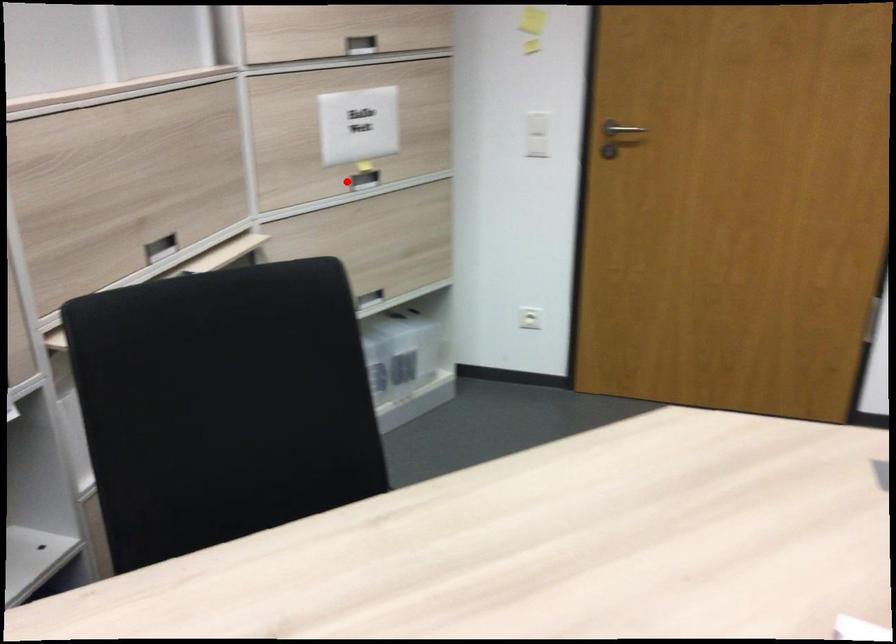
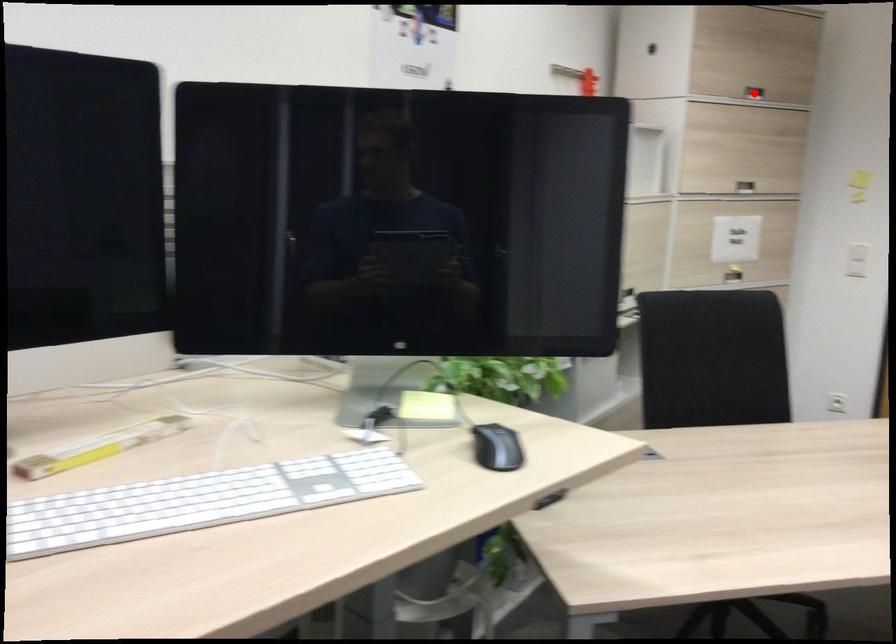
I am providing you with two images of the same scene from different viewpoints. A red point is marked on the first image and another point is marked on the second image. Does the point marked in image1 correspond to the same location as the one in image2?

No